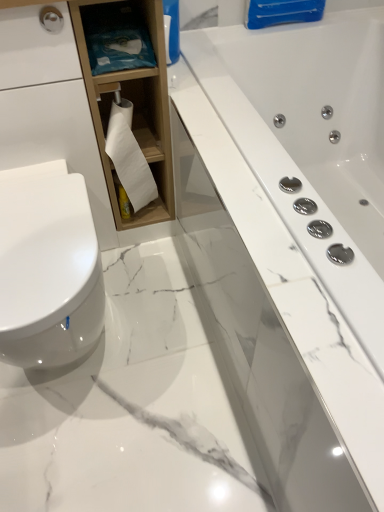
Question: Can you confirm if white glossy toilet at left is smaller than blue fabric at upper left?

Choices:
 (A) yes
 (B) no

Answer: (B)

Question: Considering the relative positions of white glossy toilet at left and blue fabric at upper left in the image provided, is white glossy toilet at left in front of blue fabric at upper left?

Choices:
 (A) no
 (B) yes

Answer: (B)

Question: Is white glossy toilet at left wider than blue fabric at upper left?

Choices:
 (A) no
 (B) yes

Answer: (B)

Question: Could you tell me if white glossy toilet at left is turned towards blue fabric at upper left?

Choices:
 (A) yes
 (B) no

Answer: (B)

Question: Is white glossy toilet at left at the right side of blue fabric at upper left?

Choices:
 (A) yes
 (B) no

Answer: (B)

Question: Does point (64, 222) appear closer or farther from the camera than point (223, 174)?

Choices:
 (A) closer
 (B) farther

Answer: (B)

Question: In terms of width, does white glossy toilet at left look wider or thinner when compared to white marble bathtub at center?

Choices:
 (A) wide
 (B) thin

Answer: (B)

Question: Visually, is white glossy toilet at left positioned to the left or to the right of white marble bathtub at center?

Choices:
 (A) left
 (B) right

Answer: (A)

Question: In terms of size, does white glossy toilet at left appear bigger or smaller than white marble bathtub at center?

Choices:
 (A) big
 (B) small

Answer: (B)

Question: Looking at their shapes, would you say white marble bathtub at center is wider or thinner than wooden cabinet at left?

Choices:
 (A) wide
 (B) thin

Answer: (A)

Question: Which is correct: white marble bathtub at center is inside wooden cabinet at left, or outside of it?

Choices:
 (A) outside
 (B) inside

Answer: (A)

Question: Based on their sizes in the image, would you say white marble bathtub at center is bigger or smaller than wooden cabinet at left?

Choices:
 (A) big
 (B) small

Answer: (A)

Question: Relative to wooden cabinet at left, is white marble bathtub at center in front or behind?

Choices:
 (A) behind
 (B) front

Answer: (B)

Question: In the image, is white matte toilet paper at center on the left side or the right side of white marble bathtub at center?

Choices:
 (A) right
 (B) left

Answer: (B)

Question: From the image's perspective, relative to white marble bathtub at center, is white matte toilet paper at center above or below?

Choices:
 (A) above
 (B) below

Answer: (A)